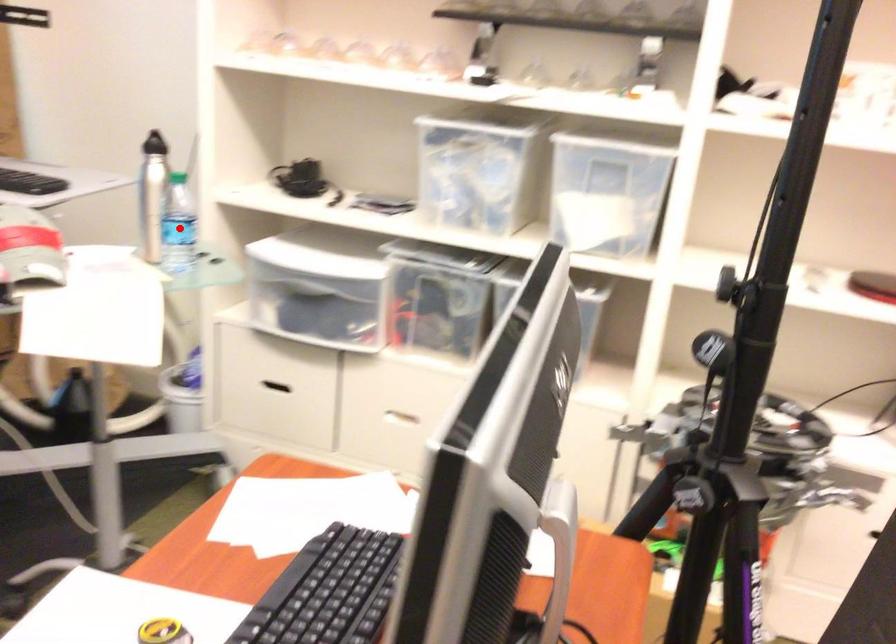
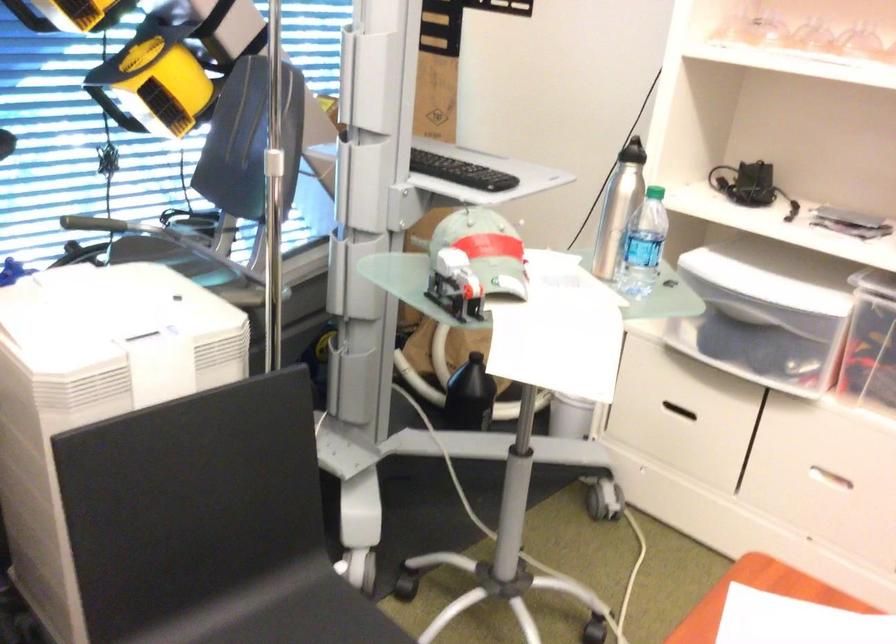
Where in the second image is the point corresponding to the highlighted location from the first image?

(643, 245)